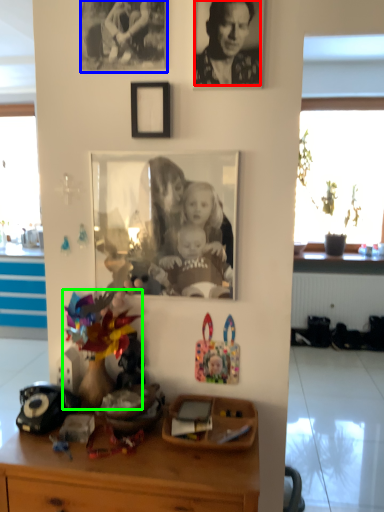
Question: Estimate the real-world distances between objects in this image. Which object is farther from person (highlighted by a red box), picture frame (highlighted by a blue box) or toy (highlighted by a green box)?

Choices:
 (A) picture frame
 (B) toy

Answer: (B)